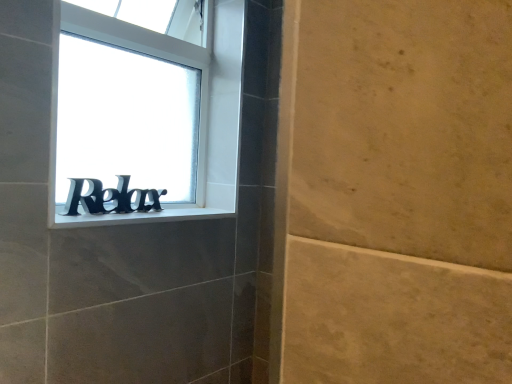
Question: Is white plastic window sill at center wider than black plastic sign at lower left?

Choices:
 (A) no
 (B) yes

Answer: (B)

Question: Is white plastic window sill at center to the left of black plastic sign at lower left from the viewer's perspective?

Choices:
 (A) yes
 (B) no

Answer: (B)

Question: Considering the relative positions of white plastic window sill at center and black plastic sign at lower left in the image provided, is white plastic window sill at center to the right of black plastic sign at lower left from the viewer's perspective?

Choices:
 (A) no
 (B) yes

Answer: (B)

Question: Is white plastic window sill at center placed right next to black plastic sign at lower left?

Choices:
 (A) yes
 (B) no

Answer: (B)

Question: From a real-world perspective, is white plastic window sill at center located beneath black plastic sign at lower left?

Choices:
 (A) yes
 (B) no

Answer: (A)

Question: Is white plastic window sill at center bigger than black plastic sign at lower left?

Choices:
 (A) yes
 (B) no

Answer: (B)

Question: Could you tell me if black metallic letters at center is facing white plastic window sill at center?

Choices:
 (A) yes
 (B) no

Answer: (A)

Question: From the image's perspective, does black metallic letters at center appear lower than white plastic window sill at center?

Choices:
 (A) yes
 (B) no

Answer: (B)

Question: Can you confirm if black metallic letters at center is bigger than white plastic window sill at center?

Choices:
 (A) no
 (B) yes

Answer: (B)

Question: Is black metallic letters at center at the right side of white plastic window sill at center?

Choices:
 (A) yes
 (B) no

Answer: (B)

Question: Is black metallic letters at center smaller than white plastic window sill at center?

Choices:
 (A) yes
 (B) no

Answer: (B)

Question: Considering the relative sizes of black metallic letters at center and white plastic window sill at center in the image provided, is black metallic letters at center shorter than white plastic window sill at center?

Choices:
 (A) no
 (B) yes

Answer: (A)

Question: Is white plastic window sill at center to the right of black metallic letters at center from the viewer's perspective?

Choices:
 (A) yes
 (B) no

Answer: (A)